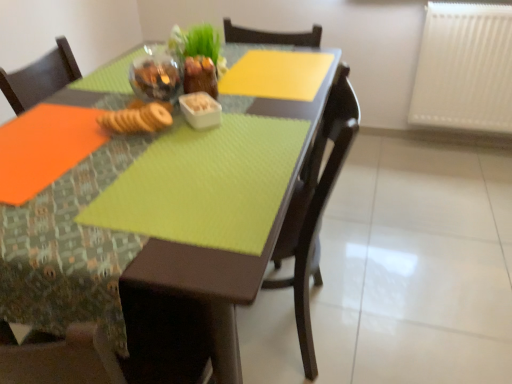
Where is `empty space that is to the right of white plastic container at center, the 1th tableware when ordered from right to left`? empty space that is to the right of white plastic container at center, the 1th tableware when ordered from right to left is located at coordinates point(267,118).